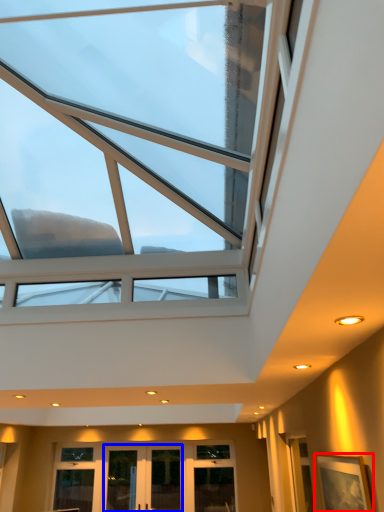
Question: Which point is closer to the camera, picture frame (highlighted by a red box) or glass door (highlighted by a blue box)?

Choices:
 (A) picture frame
 (B) glass door

Answer: (A)